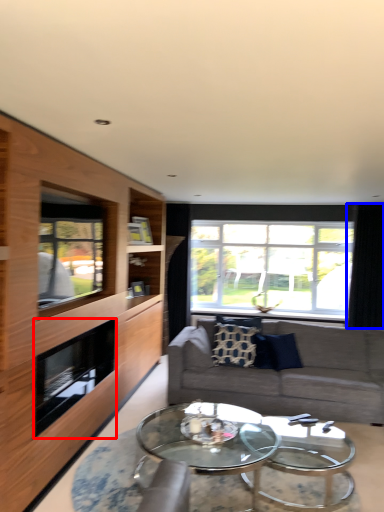
Question: Which object appears closest to the camera in this image, fireplace (highlighted by a red box) or curtain (highlighted by a blue box)?

Choices:
 (A) fireplace
 (B) curtain

Answer: (A)